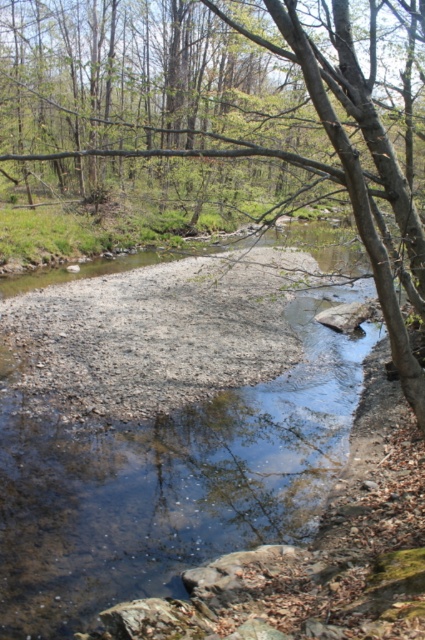
Does brown bark tree at center have a greater height compared to clear water at center?

Yes, brown bark tree at center is taller than clear water at center.

Does brown bark tree at center appear on the left side of clear water at center?

Correct, you'll find brown bark tree at center to the left of clear water at center.

Is point (47, 140) less distant than point (161, 417)?

No, (47, 140) is further to viewer.

Identify the location of brown bark tree at center. (204, 116).